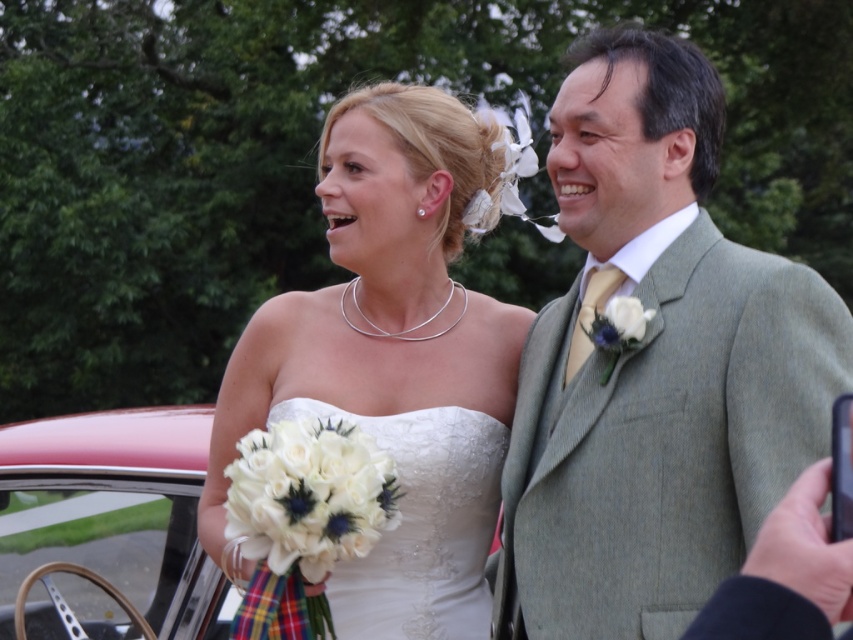
Describe the element at coordinates (654, 364) in the screenshot. I see `light gray textured suit at center` at that location.

You are a GUI agent. You are given a task and a screenshot of the screen. Output one action in this format:
    pyautogui.click(x=<x>, y=<y>)
    Task: Click on the light gray textured suit at center
    This screenshot has width=853, height=640.
    Given the screenshot: What is the action you would take?
    pyautogui.click(x=654, y=364)

The width and height of the screenshot is (853, 640). I want to click on light gray textured suit at center, so click(654, 364).

Can you confirm if white satin dress at center is shorter than white lace dress at center?

No.

Which is in front, point (399, 346) or point (459, 616)?

Point (459, 616) is more forward.

Where is `white satin dress at center`? The image size is (853, 640). white satin dress at center is located at coordinates (392, 362).

Is light gray textured suit at center bigger than white lace dress at center?

Correct, light gray textured suit at center is larger in size than white lace dress at center.

Which is more to the right, light gray textured suit at center or white lace dress at center?

Positioned to the right is light gray textured suit at center.

From the picture: Who is more distant from viewer, (527, 572) or (387, 451)?

The point (387, 451) is more distant.

Identify the location of light gray textured suit at center. (654, 364).